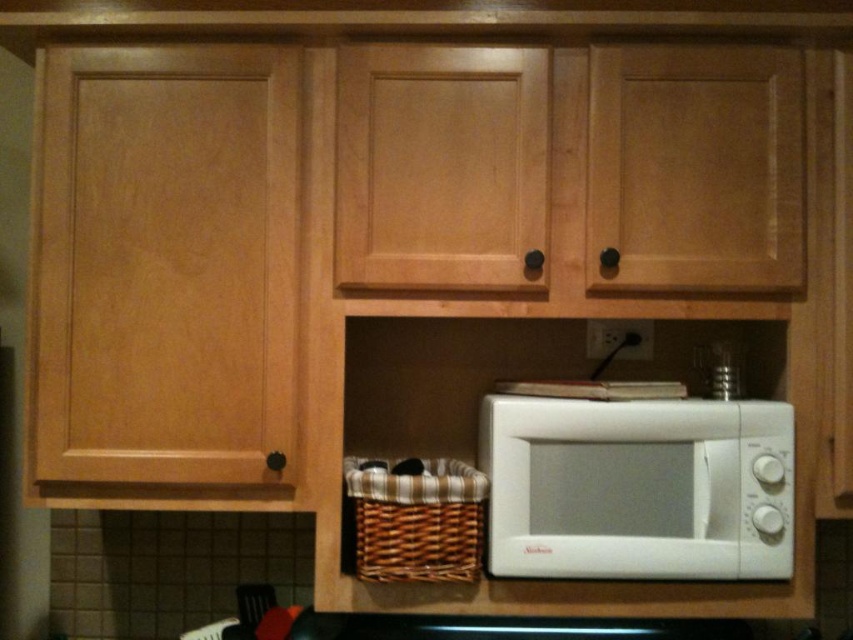
Question: Where is white matte microwave at lower right located in relation to woven brown basket at lower center in the image?

Choices:
 (A) below
 (B) above

Answer: (B)

Question: Is white matte microwave at lower right to the left of woven brown basket at lower center from the viewer's perspective?

Choices:
 (A) yes
 (B) no

Answer: (B)

Question: Which point is closer to the camera taking this photo?

Choices:
 (A) (523, 429)
 (B) (399, 557)

Answer: (B)

Question: Can you confirm if white matte microwave at lower right is wider than woven brown basket at lower center?

Choices:
 (A) yes
 (B) no

Answer: (A)

Question: Among these objects, which one is farthest from the camera?

Choices:
 (A) white matte microwave at lower right
 (B) woven brown basket at lower center

Answer: (B)

Question: Which point is farther to the camera?

Choices:
 (A) [x=346, y=476]
 (B) [x=558, y=456]

Answer: (A)